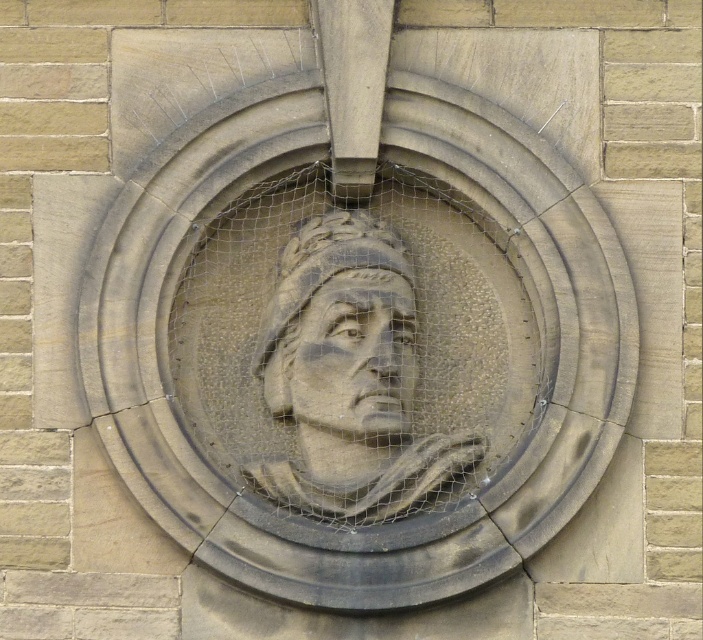
Between stone carving of man at center and stone carving head at center, which one has more height?

stone carving of man at center

Is point (309, 476) positioned behind point (385, 324)?

Yes, it is.

What are the coordinates of `stone carving of man at center` in the screenshot? It's located at (349, 376).